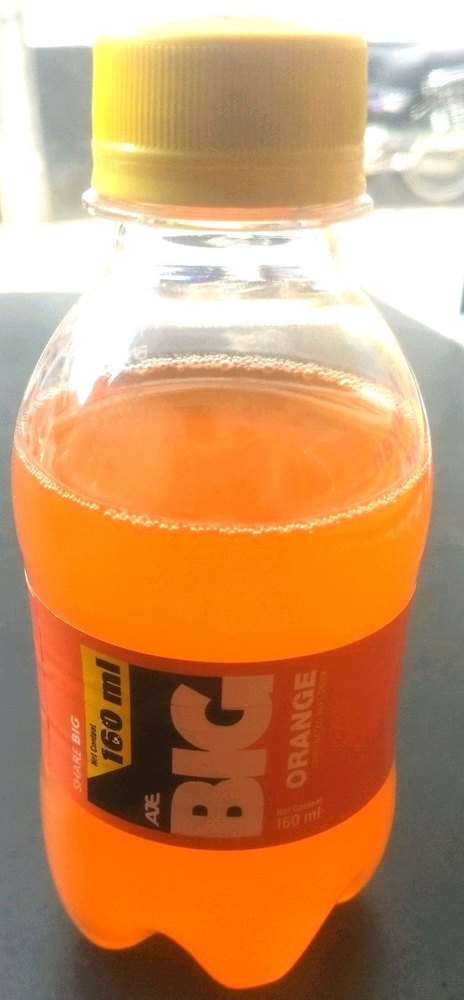
Locate an element on the screen. The width and height of the screenshot is (464, 1000). surface is located at coordinates (438, 759).